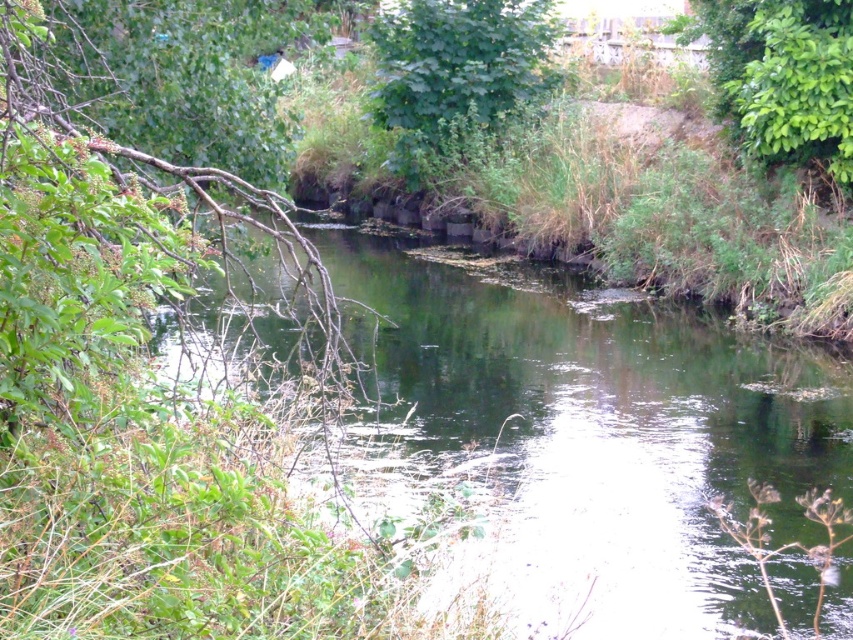
Does green leafy tree at upper left have a lesser width compared to green leafy tree at upper center?

Indeed, green leafy tree at upper left has a lesser width compared to green leafy tree at upper center.

Who is taller, green leafy tree at upper left or green leafy tree at upper center?

Standing taller between the two is green leafy tree at upper left.

Is point (175, 61) positioned in front of point (432, 100)?

That is True.

At what (x,y) coordinates should I click in order to perform the action: click on green leafy tree at upper left. Please return your answer as a coordinate pair (x, y). Looking at the image, I should click on (183, 76).

Can you confirm if green grassy stream at center is bigger than green leafy bush at upper right?

Correct, green grassy stream at center is larger in size than green leafy bush at upper right.

The width and height of the screenshot is (853, 640). What do you see at coordinates (579, 440) in the screenshot? I see `green grassy stream at center` at bounding box center [579, 440].

Find the location of a particular element. The image size is (853, 640). green grassy stream at center is located at coordinates (579, 440).

Does green grassy stream at center have a lesser height compared to green leafy tree at upper center?

Correct, green grassy stream at center is not as tall as green leafy tree at upper center.

Does point (567, 342) come in front of point (450, 19)?

Yes, it is.

Between point (389, 413) and point (422, 173), which one is positioned in front?

Positioned in front is point (389, 413).

Where is `green grassy stream at center`? green grassy stream at center is located at coordinates (579, 440).